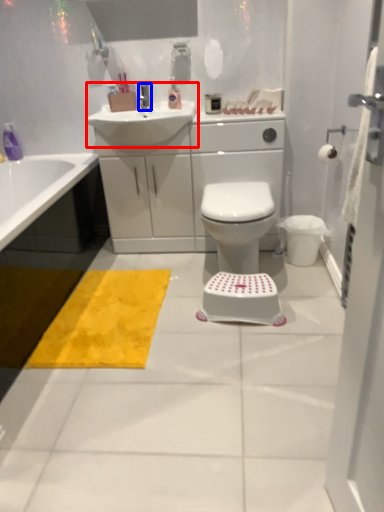
Question: Which point is further to the camera, sink (highlighted by a red box) or tap (highlighted by a blue box)?

Choices:
 (A) sink
 (B) tap

Answer: (B)